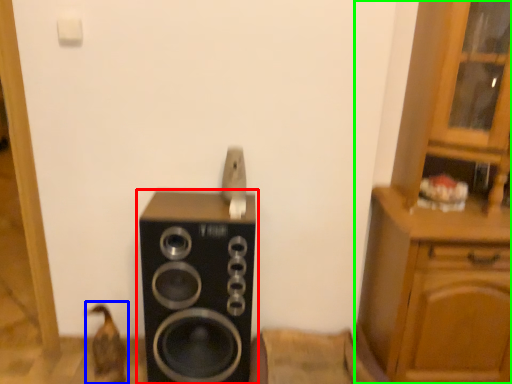
Question: Which object is positioned closest to home appliance (highlighted by a red box)? Select from animal (highlighted by a blue box) and cabinetry (highlighted by a green box).

Choices:
 (A) animal
 (B) cabinetry

Answer: (A)